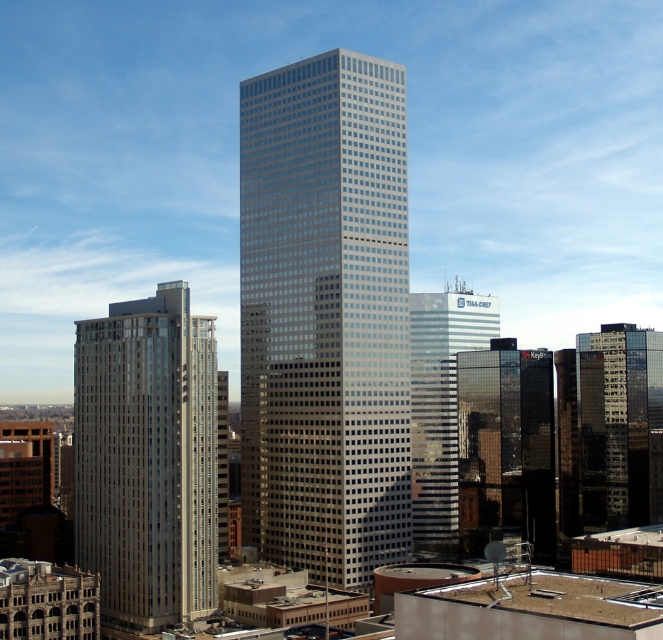
You are an architect evaluating the city skyline. You notice the shiny black glass building at center and the shiny glass skyscraper at right. Which of these two buildings is taller?

The shiny black glass building at center is taller than the shiny glass skyscraper at right according to the description.

You are an architect planning to place a new structure between the glassy silver skyscraper at center and the silver glass building at left. Based on their widths, which side should the new structure be closer to?

The glassy silver skyscraper at center might be wider than silver glass building at left, so the new structure should be closer to the silver glass building at left to maintain balance.

Please write a question that asks about the position of the glassy silver skyscraper at center in the cityscape image, ensuring that the question does not reveal its exact coordinates but requires knowledge of its location relative to the scene described.

The glassy silver skyscraper at center is positioned near the center of the image, as indicated by its coordinates at point (x=326, y=316).